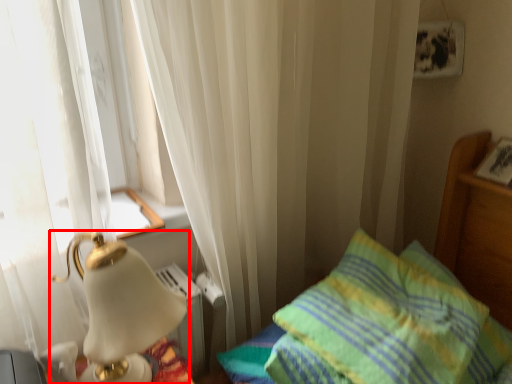
Question: Considering the relative positions of lamp (annotated by the red box) and pillow in the image provided, where is lamp (annotated by the red box) located with respect to the staircase?

Choices:
 (A) right
 (B) left

Answer: (B)